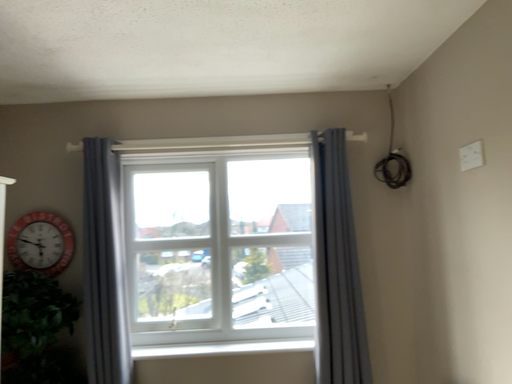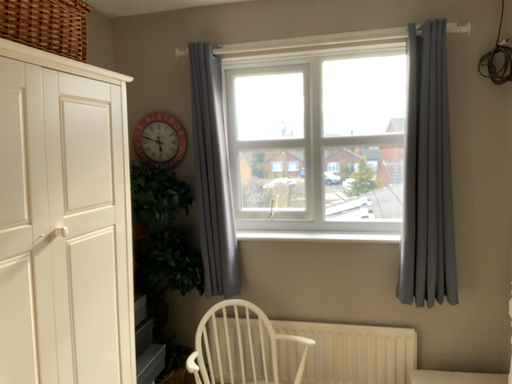
Question: How did the camera likely rotate when shooting the video?

Choices:
 (A) rotated upward
 (B) rotated downward

Answer: (B)